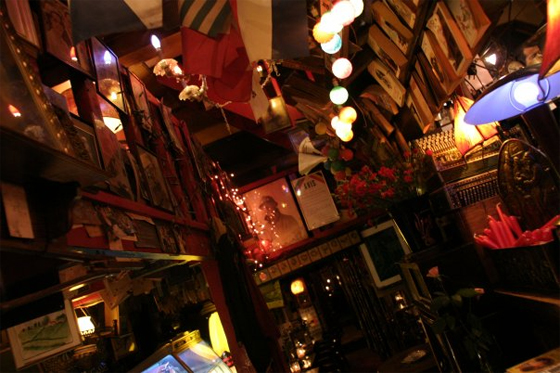
Find the location of `bucket of candles`. bucket of candles is located at coordinates (526, 256).